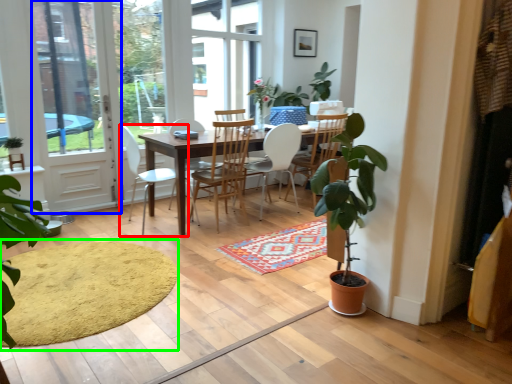
Question: Which object is the closest to the chair (highlighted by a red box)? Choose among these: screen door (highlighted by a blue box) or doormat (highlighted by a green box).

Choices:
 (A) screen door
 (B) doormat

Answer: (A)